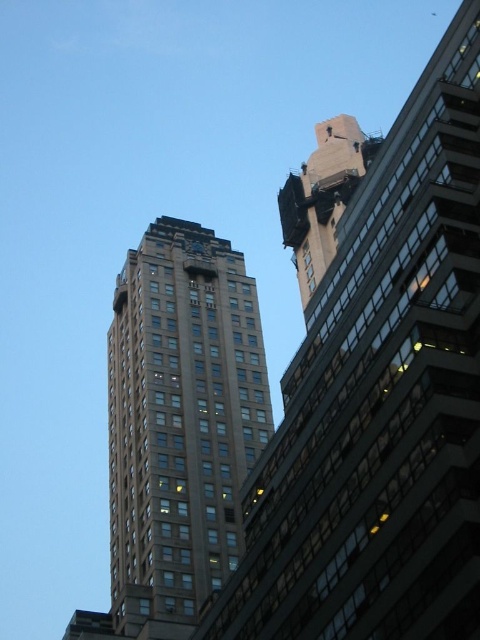
Question: Does brown glassy building at upper left appear over concrete textured tower at upper center?

Choices:
 (A) yes
 (B) no

Answer: (B)

Question: Which is nearer to the brown stone building at center?

Choices:
 (A) concrete textured tower at upper center
 (B) metallic clock at upper center
 (C) brown glassy building at upper left

Answer: (A)

Question: Is concrete textured tower at upper center positioned behind metallic clock at upper center?

Choices:
 (A) no
 (B) yes

Answer: (A)

Question: Which object is the farthest from the concrete textured tower at upper center?

Choices:
 (A) brown stone building at center
 (B) metallic clock at upper center

Answer: (A)

Question: Does brown glassy building at upper left have a greater width compared to brown stone building at center?

Choices:
 (A) no
 (B) yes

Answer: (A)

Question: Which point appears closest to the camera in this image?

Choices:
 (A) (211, 589)
 (B) (359, 637)
 (C) (201, 244)
 (D) (284, 204)

Answer: (B)